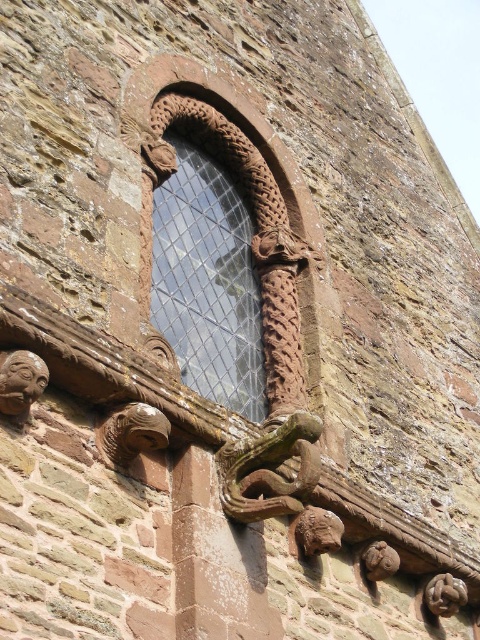
Question: Is carved stone window at upper center to the right of matte stone face at upper left from the viewer's perspective?

Choices:
 (A) no
 (B) yes

Answer: (B)

Question: Is carved stone window at upper center thinner than matte stone face at upper left?

Choices:
 (A) no
 (B) yes

Answer: (A)

Question: Does carved stone window at upper center appear on the right side of matte stone face at upper left?

Choices:
 (A) no
 (B) yes

Answer: (B)

Question: Which point is farther from the camera taking this photo?

Choices:
 (A) (21, 358)
 (B) (166, 192)

Answer: (B)

Question: Which point is farther from the camera taking this photo?

Choices:
 (A) (180, 298)
 (B) (22, 406)

Answer: (A)